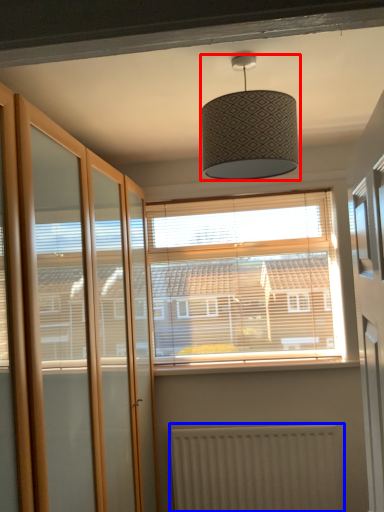
Question: Which of the following is the closest to the observer, lamp (highlighted by a red box) or radiator (highlighted by a blue box)?

Choices:
 (A) lamp
 (B) radiator

Answer: (A)